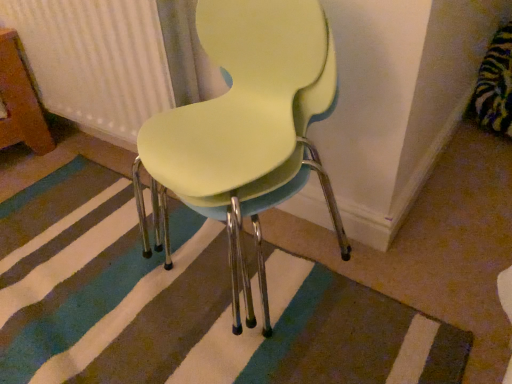
Question: Considering the relative sizes of matte yellow plastic chair at center and striped carpet at center in the image provided, is matte yellow plastic chair at center wider than striped carpet at center?

Choices:
 (A) yes
 (B) no

Answer: (B)

Question: From a real-world perspective, does matte yellow plastic chair at center sit lower than striped carpet at center?

Choices:
 (A) yes
 (B) no

Answer: (B)

Question: Is matte yellow plastic chair at center thinner than striped carpet at center?

Choices:
 (A) no
 (B) yes

Answer: (B)

Question: From the image's perspective, is matte yellow plastic chair at center on top of striped carpet at center?

Choices:
 (A) no
 (B) yes

Answer: (B)

Question: From a real-world perspective, is matte yellow plastic chair at center positioned over striped carpet at center based on gravity?

Choices:
 (A) no
 (B) yes

Answer: (B)

Question: From a real-world perspective, relative to white textured radiator at upper left, is striped carpet at center vertically above or below?

Choices:
 (A) below
 (B) above

Answer: (A)

Question: Would you say striped carpet at center is inside or outside white textured radiator at upper left?

Choices:
 (A) outside
 (B) inside

Answer: (A)

Question: Considering the positions of striped carpet at center and white textured radiator at upper left in the image, is striped carpet at center taller or shorter than white textured radiator at upper left?

Choices:
 (A) tall
 (B) short

Answer: (B)

Question: In terms of width, does striped carpet at center look wider or thinner when compared to white textured radiator at upper left?

Choices:
 (A) wide
 (B) thin

Answer: (A)

Question: Is white textured radiator at upper left taller or shorter than matte yellow plastic chair at center?

Choices:
 (A) short
 (B) tall

Answer: (A)

Question: Considering their positions, is white textured radiator at upper left located in front of or behind matte yellow plastic chair at center?

Choices:
 (A) behind
 (B) front

Answer: (A)

Question: Considering the relative positions of white textured radiator at upper left and matte yellow plastic chair at center in the image provided, is white textured radiator at upper left to the left or to the right of matte yellow plastic chair at center?

Choices:
 (A) right
 (B) left

Answer: (B)

Question: From the image's perspective, is white textured radiator at upper left positioned above or below matte yellow plastic chair at center?

Choices:
 (A) below
 (B) above

Answer: (B)

Question: Considering the positions of matte yellow plastic chair at center and white textured radiator at upper left in the image, is matte yellow plastic chair at center wider or thinner than white textured radiator at upper left?

Choices:
 (A) thin
 (B) wide

Answer: (B)

Question: Considering the positions of matte yellow plastic chair at center and white textured radiator at upper left in the image, is matte yellow plastic chair at center bigger or smaller than white textured radiator at upper left?

Choices:
 (A) small
 (B) big

Answer: (B)